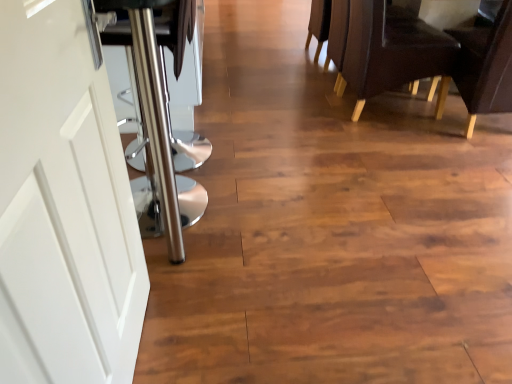
Question: From the image's perspective, is white matte door at left located beneath leather-like dark brown chair at right, which is the 2th chair from right to left?

Choices:
 (A) yes
 (B) no

Answer: (A)

Question: Considering the relative positions of white matte door at left and leather-like dark brown chair at right, which is the 2th chair from right to left, in the image provided, is white matte door at left to the left of leather-like dark brown chair at right, which is the 2th chair from right to left, from the viewer's perspective?

Choices:
 (A) no
 (B) yes

Answer: (B)

Question: Considering the relative sizes of white matte door at left and leather-like dark brown chair at right, which is the 2th chair from right to left, in the image provided, is white matte door at left smaller than leather-like dark brown chair at right, which is the 2th chair from right to left,?

Choices:
 (A) yes
 (B) no

Answer: (A)

Question: Is leather-like dark brown chair at right, the 1th chair from the left, a part of white matte door at left?

Choices:
 (A) yes
 (B) no

Answer: (B)

Question: Can you confirm if white matte door at left is shorter than leather-like dark brown chair at right, which is the 2th chair from right to left?

Choices:
 (A) yes
 (B) no

Answer: (B)

Question: From a real-world perspective, does white matte door at left sit lower than leather-like dark brown chair at right, which is the 2th chair from right to left?

Choices:
 (A) no
 (B) yes

Answer: (A)

Question: Is brown leather chair at upper right, the 2th chair when ordered from left to right, positioned beyond the bounds of white matte door at left?

Choices:
 (A) no
 (B) yes

Answer: (B)

Question: Is brown leather chair at upper right, the 2th chair when ordered from left to right, to the left of white matte door at left from the viewer's perspective?

Choices:
 (A) no
 (B) yes

Answer: (A)

Question: Is brown leather chair at upper right, marked as the 1th chair in a right-to-left arrangement, positioned in front of white matte door at left?

Choices:
 (A) yes
 (B) no

Answer: (B)

Question: Is brown leather chair at upper right, the 2th chair when ordered from left to right, wider than white matte door at left?

Choices:
 (A) no
 (B) yes

Answer: (B)

Question: Considering the relative sizes of brown leather chair at upper right, the 2th chair when ordered from left to right, and white matte door at left in the image provided, is brown leather chair at upper right, the 2th chair when ordered from left to right, bigger than white matte door at left?

Choices:
 (A) no
 (B) yes

Answer: (B)

Question: Is brown leather chair at upper right, the 2th chair when ordered from left to right, looking in the opposite direction of white matte door at left?

Choices:
 (A) no
 (B) yes

Answer: (A)

Question: From the image's perspective, is leather-like dark brown chair at right, which is the 2th chair from right to left, beneath brown leather chair at upper right, the 2th chair when ordered from left to right?

Choices:
 (A) yes
 (B) no

Answer: (B)